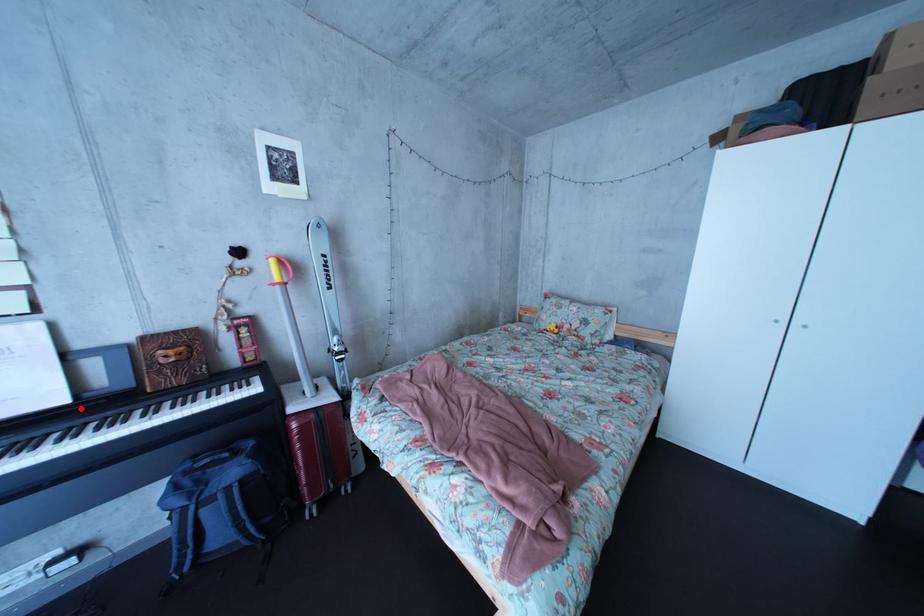
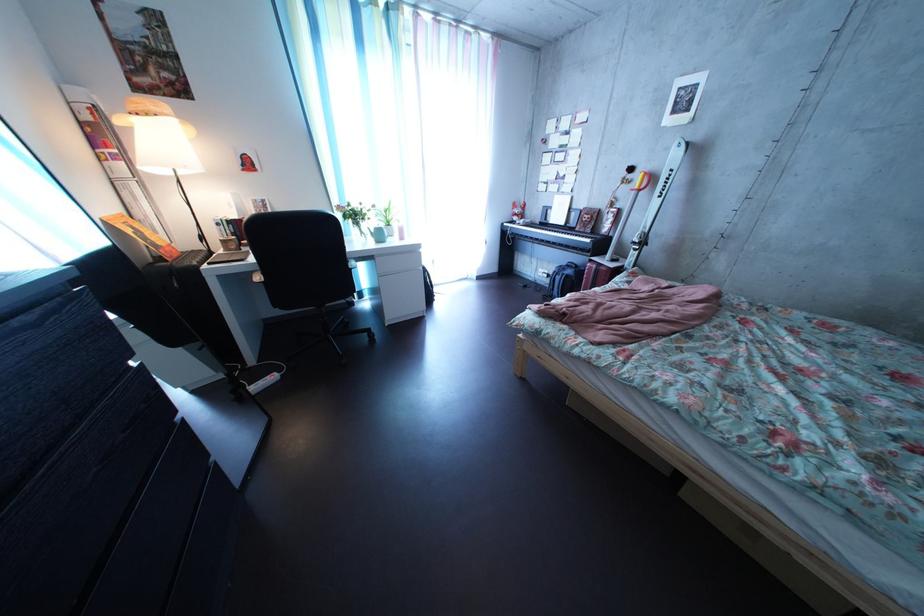
Question: I am providing you with two images of the same scene from different viewpoints. In image1, a red point is highlighted. Considering the same 3D point in image2, which of the following is correct?

Choices:
 (A) It is closer
 (B) It is farther

Answer: (A)